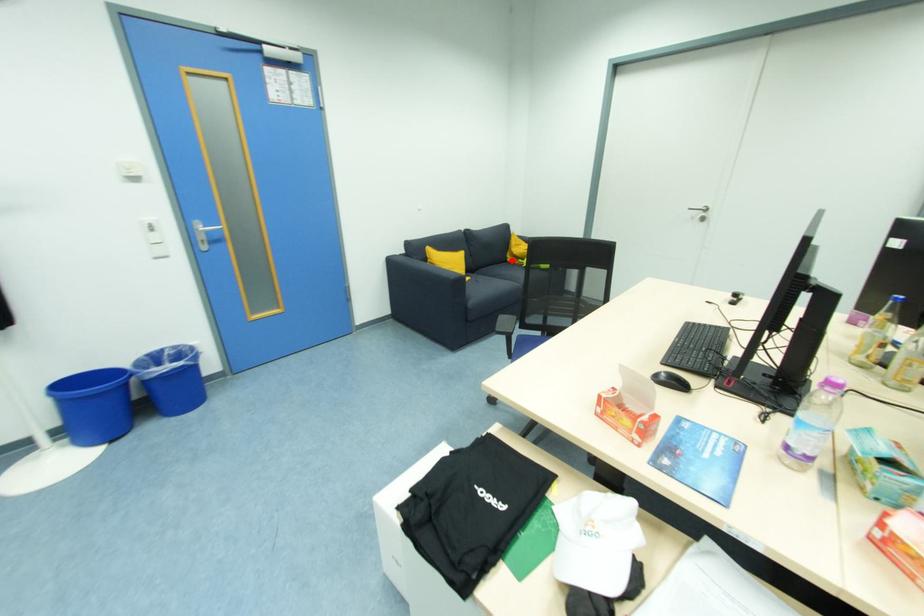
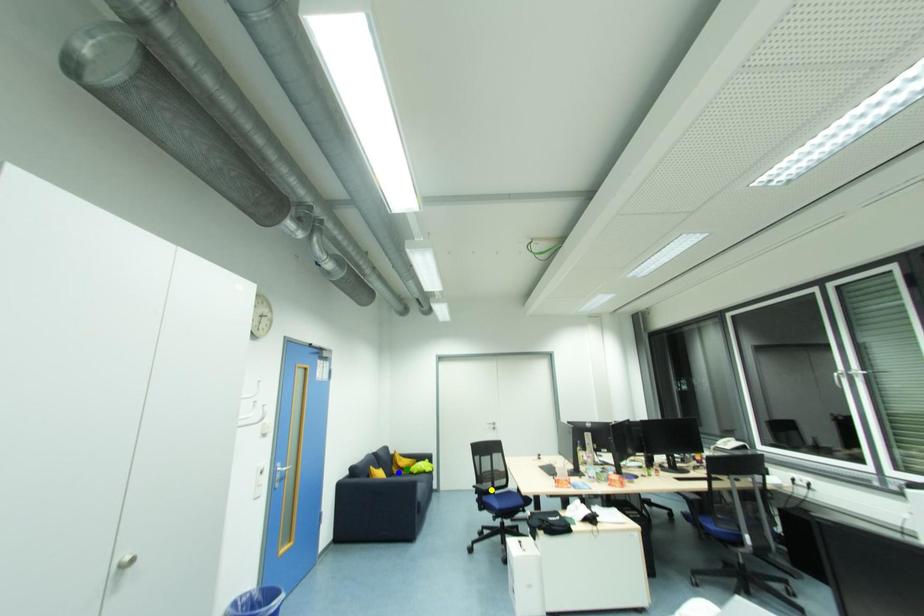
Question: I am providing you with two images of the same scene from different viewpoints. A red point is marked on the first image. You are given multiple points on the second image. Can you choose the point in image 2 that corresponds to the point in image 1?

Choices:
 (A) green point
 (B) blue point
 (C) yellow point

Answer: (B)